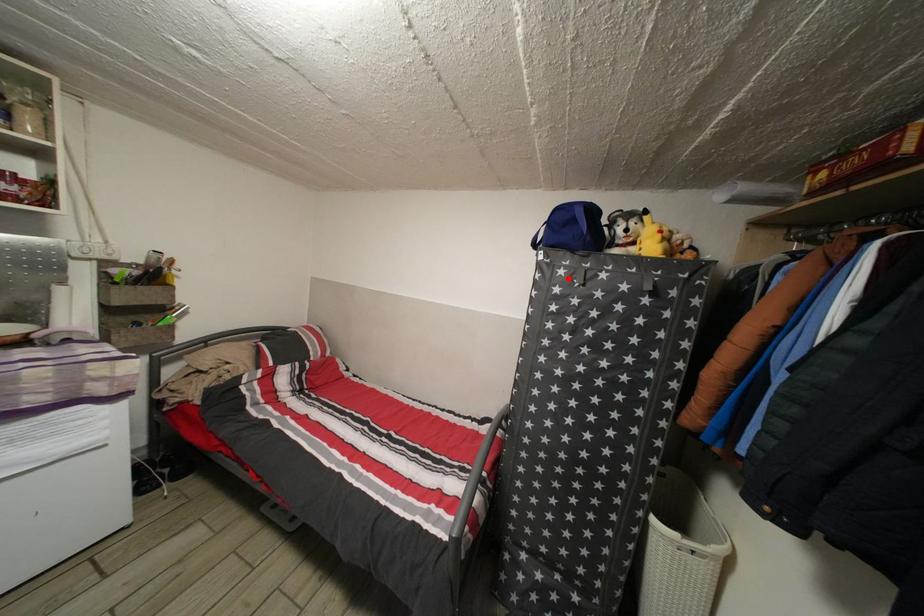
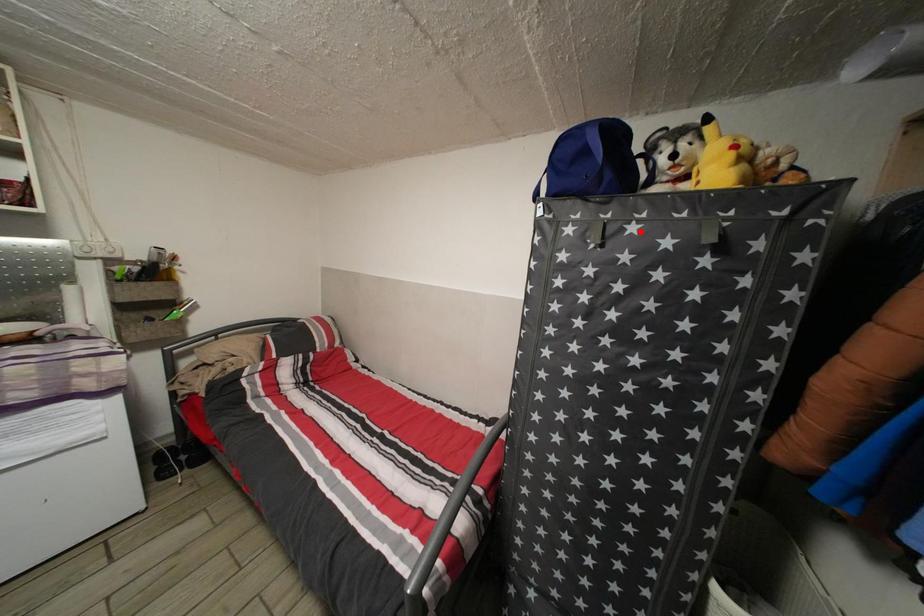
I am providing you with two images of the same scene from different viewpoints. A red point is marked on the first image and another point is marked on the second image. Does the point marked in image1 correspond to the same location as the one in image2?

No